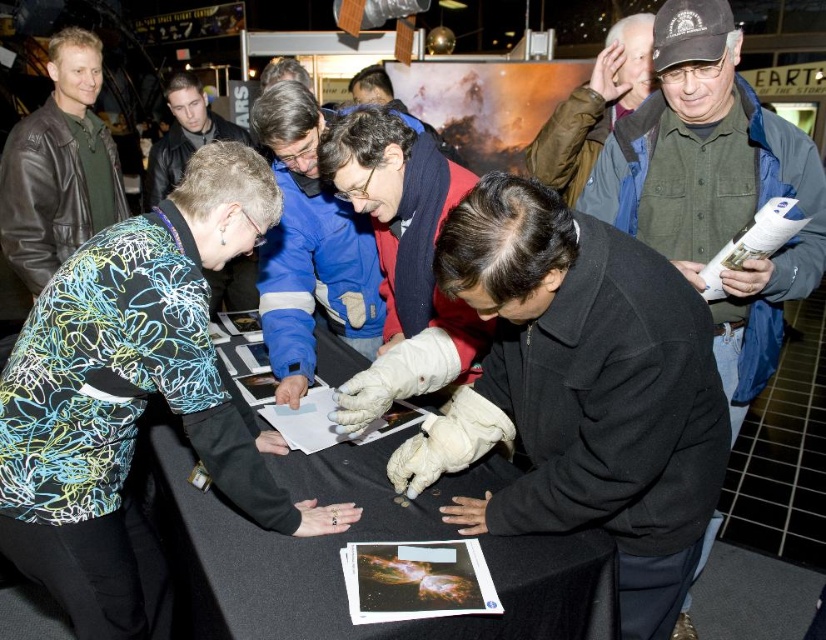
Question: Which object appears closest to the camera in this image?

Choices:
 (A) green button-down shirt at upper right
 (B) black fabric table at center
 (C) blue fleece jacket at center
 (D) matte black jacket at left

Answer: (B)

Question: Which object is the closest to the blue fleece jacket at center?

Choices:
 (A) matte black jacket at left
 (B) green button-down shirt at upper right
 (C) blue patterned jacket at center

Answer: (B)

Question: Is matte black jacket at left positioned at the back of brown leather jacket at upper right?

Choices:
 (A) no
 (B) yes

Answer: (B)

Question: Which object is closer to the camera taking this photo?

Choices:
 (A) black fabric table at center
 (B) blue patterned jacket at center
 (C) blue fleece jacket at center
 (D) matte black jacket at left

Answer: (A)

Question: Considering the relative positions of black fabric table at center and blue fleece jacket at center in the image provided, where is black fabric table at center located with respect to blue fleece jacket at center?

Choices:
 (A) right
 (B) left

Answer: (A)

Question: Is black fabric table at center to the right of matte black jacket at left from the viewer's perspective?

Choices:
 (A) yes
 (B) no

Answer: (A)